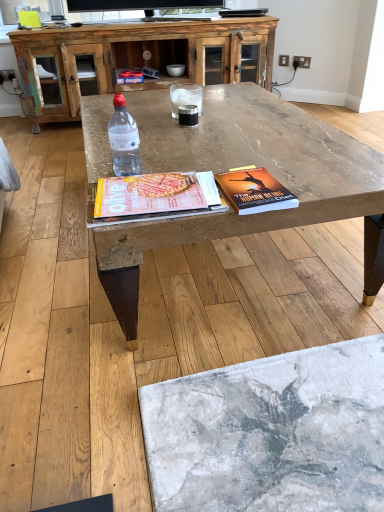
The width and height of the screenshot is (384, 512). In order to click on vacant area situated to the left side of black rubberized cup at center in this screenshot , I will do `click(153, 123)`.